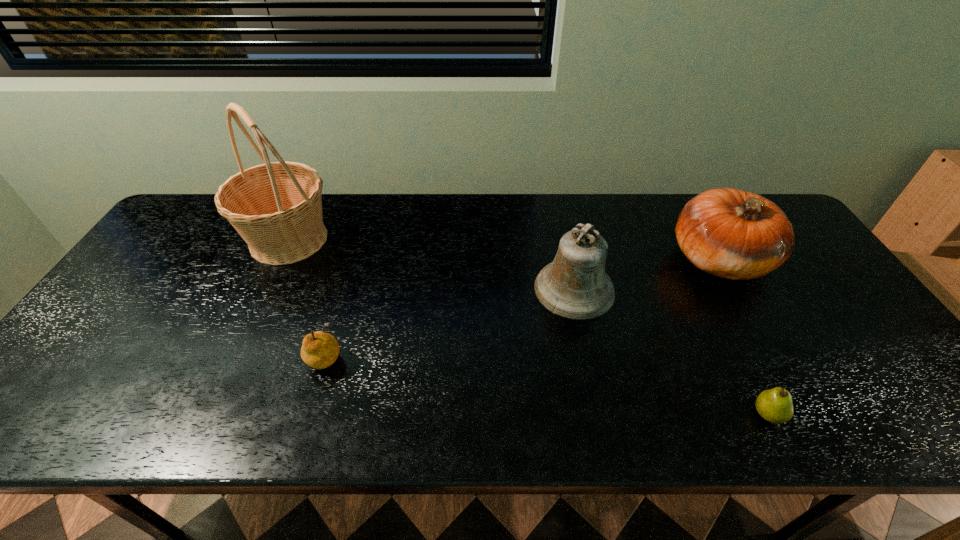
The image size is (960, 540). Find the location of `free space between the bell and the basket`. free space between the bell and the basket is located at coordinates tap(432, 265).

This screenshot has height=540, width=960. I want to click on the second closest object to the nearer pear, so click(575, 286).

The width and height of the screenshot is (960, 540). I want to click on object that ranks as the third closest to the nearest object, so click(319, 350).

Where is `vacant space that satisfies the following two spatial constraints: 1. on the back side of the pumpkin; 2. on the left side of the third object from right to left`? Image resolution: width=960 pixels, height=540 pixels. vacant space that satisfies the following two spatial constraints: 1. on the back side of the pumpkin; 2. on the left side of the third object from right to left is located at coordinates (568, 260).

Identify the location of free spot that satisfies the following two spatial constraints: 1. on the front side of the nearer pear; 2. on the right side of the basket. (206, 414).

The width and height of the screenshot is (960, 540). Find the location of `vacant space that satisfies the following two spatial constraints: 1. on the front side of the basket; 2. on the left side of the pumpkin`. vacant space that satisfies the following two spatial constraints: 1. on the front side of the basket; 2. on the left side of the pumpkin is located at coordinates (279, 260).

Locate an element on the screen. This screenshot has height=540, width=960. vacant space that satisfies the following two spatial constraints: 1. on the back side of the pumpkin; 2. on the right side of the right pear is located at coordinates (691, 260).